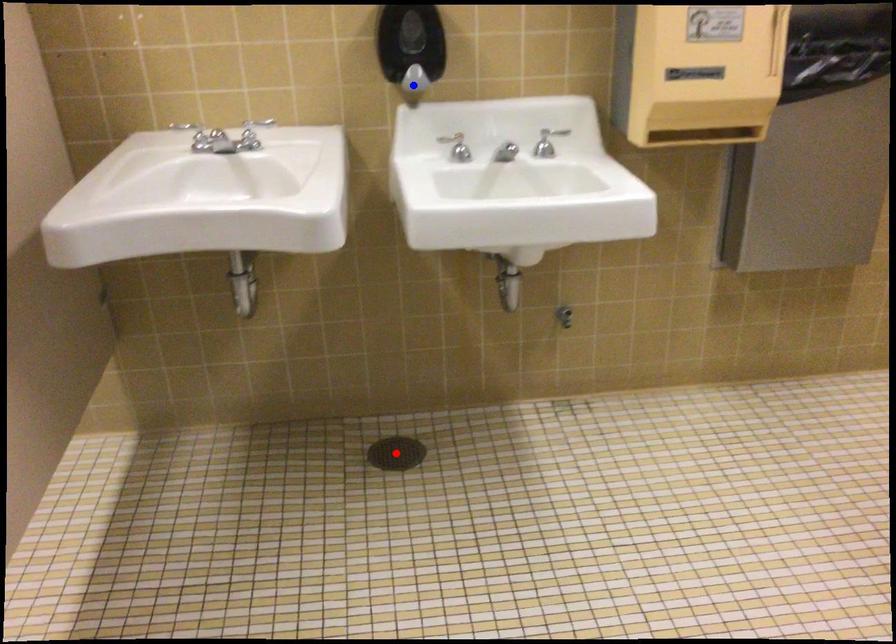
Question: Which of the two points in the image is closer to the camera?

Choices:
 (A) Blue point is closer.
 (B) Red point is closer.

Answer: (A)